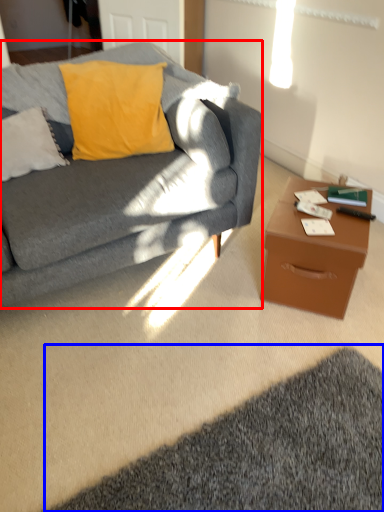
Question: Which object is closer to the camera taking this photo, studio couch (highlighted by a red box) or mat (highlighted by a blue box)?

Choices:
 (A) studio couch
 (B) mat

Answer: (B)